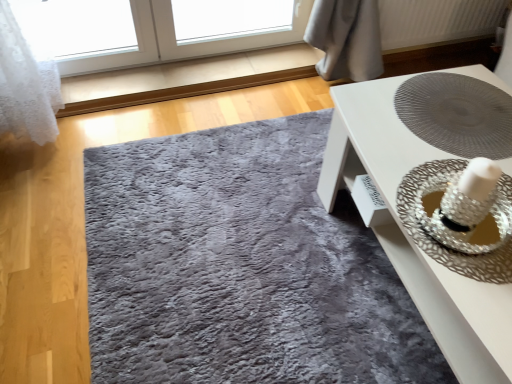
Locate an element on the screen. The height and width of the screenshot is (384, 512). empty space that is ontop of white glossy table at center is located at coordinates (450, 145).